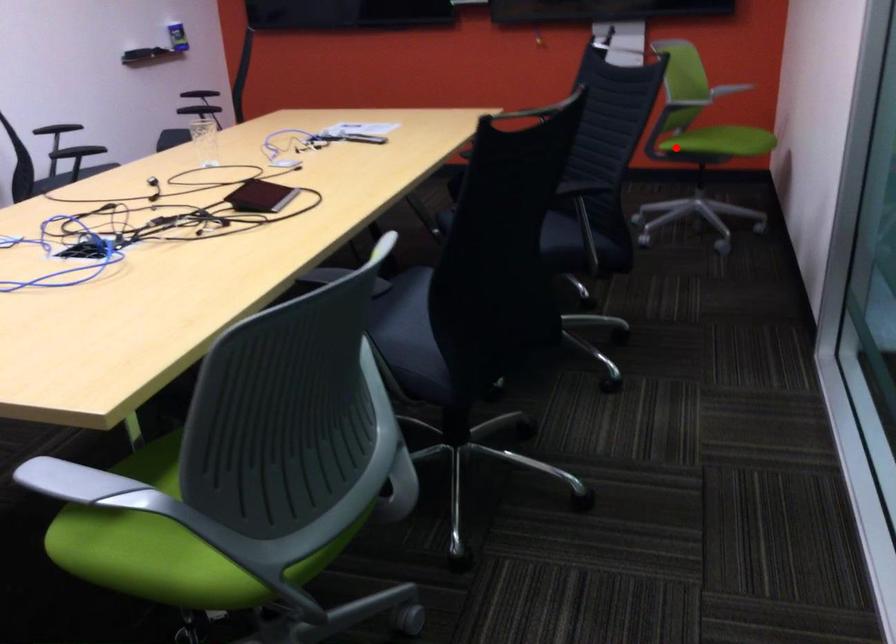
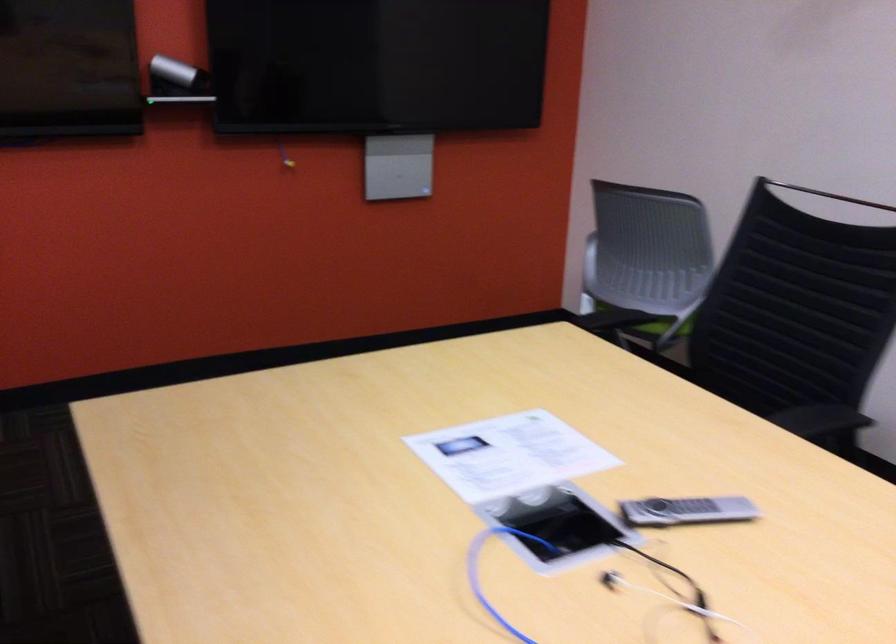
Question: I am providing you with two images of the same scene from different viewpoints. In image1, a red point is highlighted. Considering the same 3D point in image2, which of the following is correct?

Choices:
 (A) It is closer
 (B) It is farther

Answer: (A)